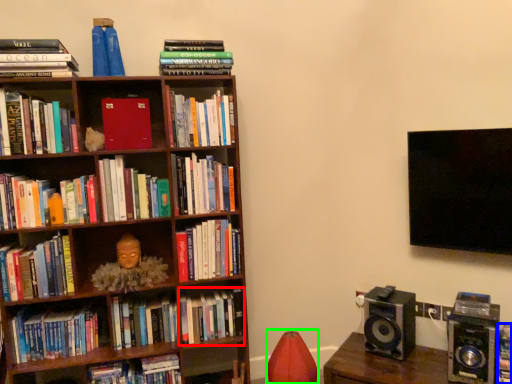
Question: Estimate the real-world distances between objects in this image. Which object is closer to book (highlighted by a red box), book (highlighted by a blue box) or bean bag chair (highlighted by a green box)?

Choices:
 (A) book
 (B) bean bag chair

Answer: (B)